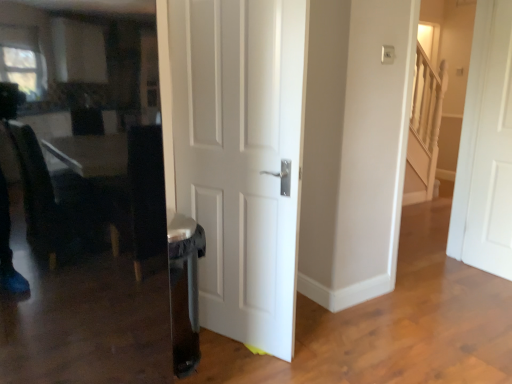
Describe the element at coordinates (238, 155) in the screenshot. I see `white matte door at center, the second door in the right-to-left sequence` at that location.

What is the approximate width of white matte door at center, the first door from the front?

white matte door at center, the first door from the front, is 5.03 centimeters wide.

Identify the location of white matte door at center, which is the second door in back-to-front order. The image size is (512, 384). (238, 155).

I want to click on white matte door at right, placed as the first door when sorted from right to left, so click(x=493, y=157).

What do you see at coordinates (493, 157) in the screenshot? I see `white matte door at right, placed as the first door when sorted from right to left` at bounding box center [493, 157].

The height and width of the screenshot is (384, 512). What are the coordinates of `white matte door at center, which is the second door in back-to-front order` in the screenshot? It's located at (238, 155).

Which is more to the left, white matte door at center, the second door in the right-to-left sequence, or white matte door at right, placed as the first door when sorted from right to left?

white matte door at center, the second door in the right-to-left sequence, is more to the left.

From the picture: Is the position of white matte door at center, which is the second door in back-to-front order, more distant than that of white matte door at right, placed as the first door when sorted from right to left?

That is False.

Which is in front, point (293, 89) or point (472, 210)?

The point (293, 89) is more forward.

From the image's perspective, is white matte door at center, which is the second door in back-to-front order, over white matte door at right, the first door in the back-to-front sequence?

No, from the image's perspective, white matte door at center, which is the second door in back-to-front order, is not on top of white matte door at right, the first door in the back-to-front sequence.

From a real-world perspective, is white matte door at center, the second door in the right-to-left sequence, positioned under white matte door at right, the 2th door in the front-to-back sequence, based on gravity?

Yes.

Between white matte door at center, positioned as the first door in left-to-right order, and white matte door at right, the first door in the back-to-front sequence, which one has larger width?

white matte door at center, positioned as the first door in left-to-right order.

Is white matte door at center, positioned as the first door in left-to-right order, shorter than white matte door at right, placed as the first door when sorted from right to left?

Correct, white matte door at center, positioned as the first door in left-to-right order, is not as tall as white matte door at right, placed as the first door when sorted from right to left.

Does white matte door at center, which is the second door in back-to-front order, have a larger size compared to white matte door at right, placed as the first door when sorted from right to left?

Yes, white matte door at center, which is the second door in back-to-front order, is bigger than white matte door at right, placed as the first door when sorted from right to left.

Would you say white matte door at center, which is the second door in back-to-front order, is outside white matte door at right, placed as the first door when sorted from right to left?

white matte door at center, which is the second door in back-to-front order, is positioned outside white matte door at right, placed as the first door when sorted from right to left.

Can you see white matte door at center, the first door from the front, touching white matte door at right, the 2th door in the front-to-back sequence?

No.

Is white matte door at center, which is the second door in back-to-front order, looking in the opposite direction of white matte door at right, placed as the first door when sorted from right to left?

white matte door at center, which is the second door in back-to-front order, does not have its back to white matte door at right, placed as the first door when sorted from right to left.

What's the angular difference between white matte door at center, positioned as the first door in left-to-right order, and white matte door at right, the 2th door in the front-to-back sequence,'s facing directions?

153 degrees separate the facing orientations of white matte door at center, positioned as the first door in left-to-right order, and white matte door at right, the 2th door in the front-to-back sequence.

Measure the distance from white matte door at center, which is the second door in back-to-front order, to white matte door at right, which ranks as the second door in left-to-right order.

white matte door at center, which is the second door in back-to-front order, is 1.81 meters away from white matte door at right, which ranks as the second door in left-to-right order.

Where is `door lying on the left of white matte door at right, placed as the first door when sorted from right to left`? The height and width of the screenshot is (384, 512). door lying on the left of white matte door at right, placed as the first door when sorted from right to left is located at coordinates (238, 155).

Can you confirm if white matte door at right, which ranks as the second door in left-to-right order, is positioned to the left of white matte door at center, positioned as the first door in left-to-right order?

In fact, white matte door at right, which ranks as the second door in left-to-right order, is to the right of white matte door at center, positioned as the first door in left-to-right order.

Which object is closer to the camera taking this photo, white matte door at right, placed as the first door when sorted from right to left, or white matte door at center, the second door in the right-to-left sequence?

white matte door at center, the second door in the right-to-left sequence, is more forward.

Between point (508, 96) and point (240, 212), which one is positioned behind?

Point (508, 96)

From the image's perspective, is white matte door at right, the 2th door in the front-to-back sequence, above white matte door at center, which is the second door in back-to-front order?

Yes, from the image's perspective, white matte door at right, the 2th door in the front-to-back sequence, is above white matte door at center, which is the second door in back-to-front order.

From a real-world perspective, does white matte door at right, the 2th door in the front-to-back sequence, stand above white matte door at center, positioned as the first door in left-to-right order?

Correct, in the physical world, white matte door at right, the 2th door in the front-to-back sequence, is higher than white matte door at center, positioned as the first door in left-to-right order.

Is white matte door at right, which ranks as the second door in left-to-right order, wider than white matte door at center, the first door from the front?

No.

Can you confirm if white matte door at right, placed as the first door when sorted from right to left, is taller than white matte door at center, the second door in the right-to-left sequence?

Yes, white matte door at right, placed as the first door when sorted from right to left, is taller than white matte door at center, the second door in the right-to-left sequence.

Looking at this image, does white matte door at right, the first door in the back-to-front sequence, have a larger size compared to white matte door at center, the first door from the front?

Incorrect, white matte door at right, the first door in the back-to-front sequence, is not larger than white matte door at center, the first door from the front.

Would you say white matte door at right, the 2th door in the front-to-back sequence, is inside or outside white matte door at center, the first door from the front?

The correct answer is: outside.

Would you consider white matte door at right, the 2th door in the front-to-back sequence, to be distant from white matte door at center, positioned as the first door in left-to-right order?

Indeed, white matte door at right, the 2th door in the front-to-back sequence, is not near white matte door at center, positioned as the first door in left-to-right order.

Could you tell me if white matte door at right, which ranks as the second door in left-to-right order, is turned towards white matte door at center, the second door in the right-to-left sequence?

Yes, white matte door at right, which ranks as the second door in left-to-right order, is facing white matte door at center, the second door in the right-to-left sequence.

What's the angular difference between white matte door at right, the first door in the back-to-front sequence, and white matte door at center, the second door in the right-to-left sequence,'s facing directions?

white matte door at right, the first door in the back-to-front sequence, and white matte door at center, the second door in the right-to-left sequence, are facing 153 degrees away from each other.

I want to click on door to the right of white matte door at center, the second door in the right-to-left sequence, so click(x=493, y=157).

I want to click on door lying in front of the white matte door at right, the first door in the back-to-front sequence, so click(238, 155).

This screenshot has width=512, height=384. I want to click on door located below the white matte door at right, the first door in the back-to-front sequence (from the image's perspective), so click(238, 155).